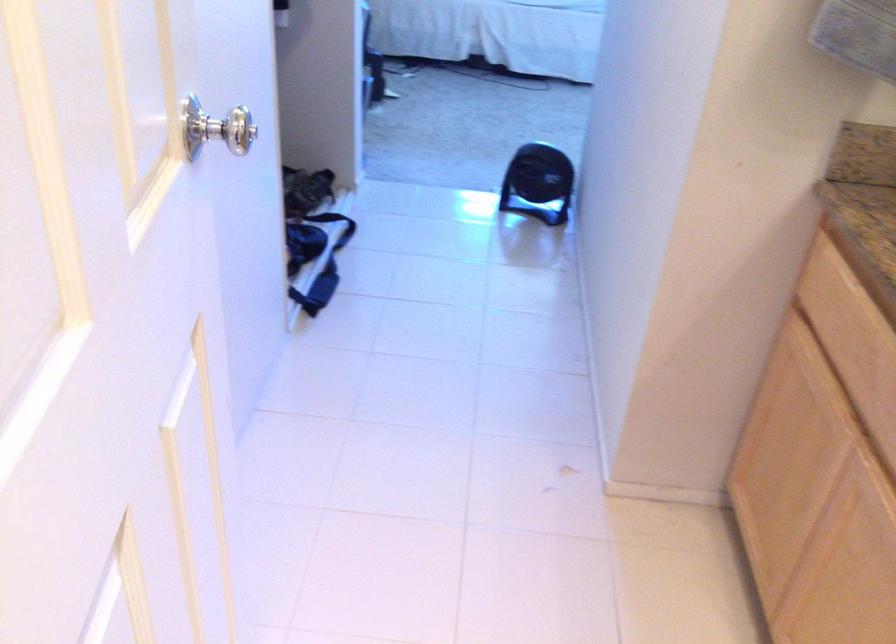
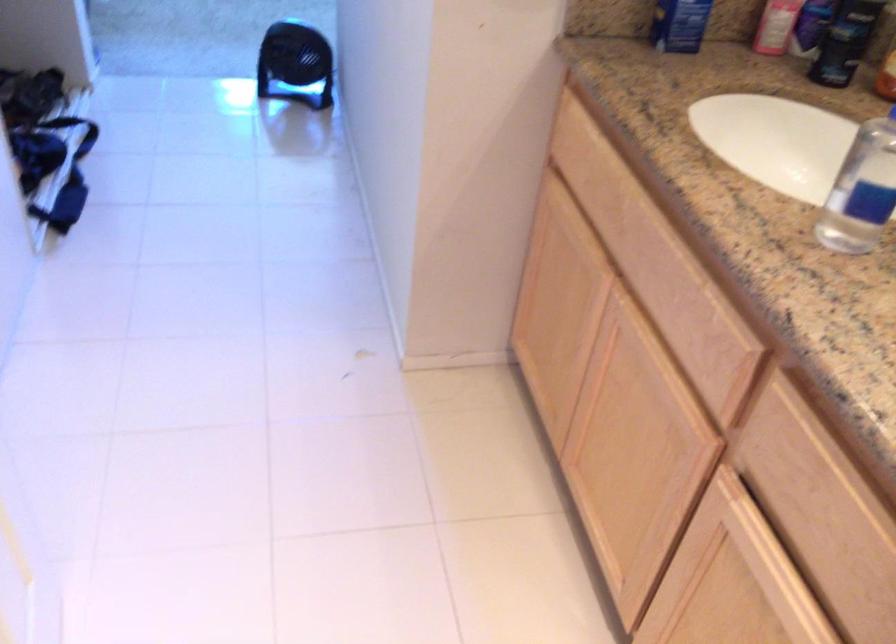
Where in the second image is the point corresponding to point 533,181 from the first image?

(295, 64)